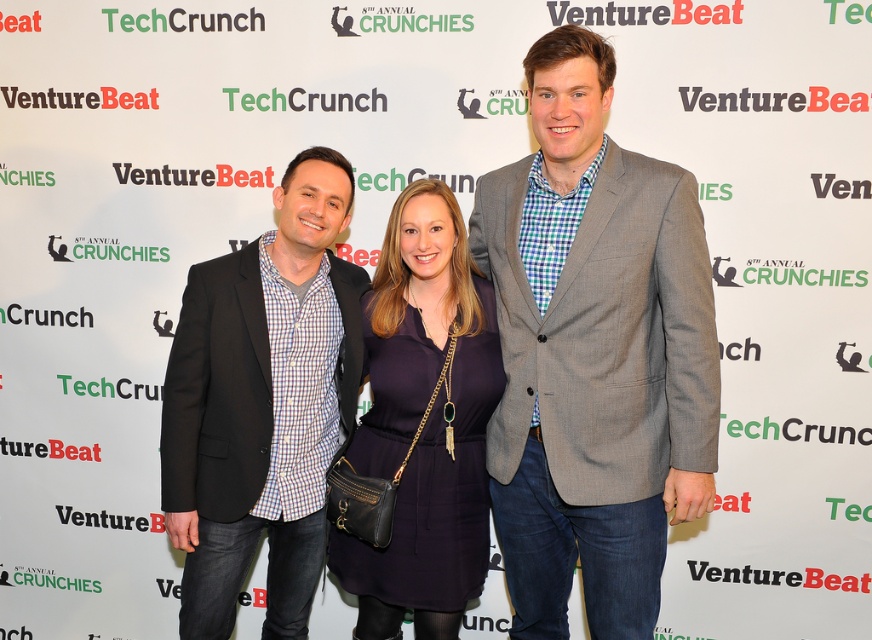
Does gray wool blazer at center appear over matte black blazer at center?

Yes.

Where is `gray wool blazer at center`? This screenshot has height=640, width=872. gray wool blazer at center is located at coordinates (593, 353).

Locate an element on the screen. gray wool blazer at center is located at coordinates [593, 353].

Does matte black blazer at center appear on the right side of navy matte dress at center?

No, matte black blazer at center is not to the right of navy matte dress at center.

Who is positioned more to the right, matte black blazer at center or navy matte dress at center?

Positioned to the right is navy matte dress at center.

Locate an element on the screen. The width and height of the screenshot is (872, 640). matte black blazer at center is located at coordinates (262, 404).

Between gray wool blazer at center and navy matte dress at center, which one is positioned higher?

Positioned higher is gray wool blazer at center.

Is gray wool blazer at center bigger than navy matte dress at center?

Correct, gray wool blazer at center is larger in size than navy matte dress at center.

The width and height of the screenshot is (872, 640). I want to click on gray wool blazer at center, so click(x=593, y=353).

The height and width of the screenshot is (640, 872). In order to click on gray wool blazer at center in this screenshot , I will do `click(593, 353)`.